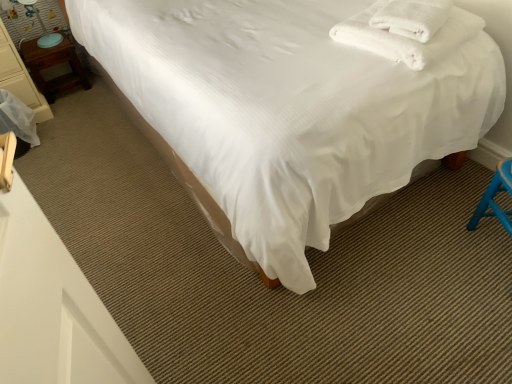
Locate an element on the screen. This screenshot has width=512, height=384. free area in between white smooth bed at center and wooden nightstand at left is located at coordinates (121, 148).